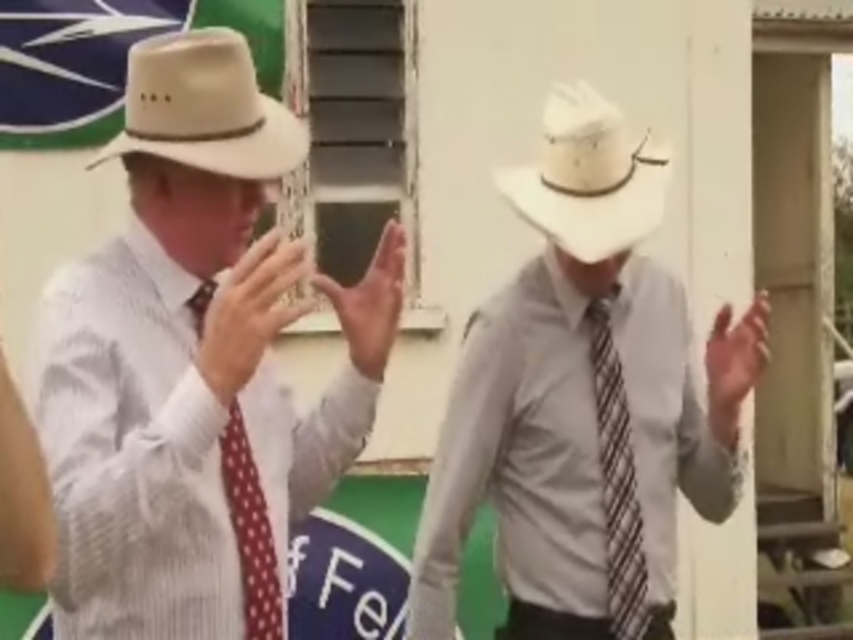
Question: Is matte beige hat at left above beige felt fedora at upper left?

Choices:
 (A) no
 (B) yes

Answer: (A)

Question: Where is matte beige hat at left located in relation to white straw cowboy hat at center in the image?

Choices:
 (A) left
 (B) right

Answer: (A)

Question: Which object is farther from the camera taking this photo?

Choices:
 (A) beige felt fedora at upper left
 (B) matte beige hat at left
 (C) white straw cowboy hat at center
 (D) polka dot fabric tie at left

Answer: (C)

Question: Which point is farther to the camera?

Choices:
 (A) (672, 410)
 (B) (590, 160)
 (C) (618, 540)

Answer: (A)

Question: Among these points, which one is farthest from the camera?

Choices:
 (A) (543, 145)
 (B) (630, 616)
 (C) (492, 492)

Answer: (C)

Question: Can you confirm if matte white cowboy hat at center is positioned to the right of white straw cowboy hat at center?

Choices:
 (A) no
 (B) yes

Answer: (B)